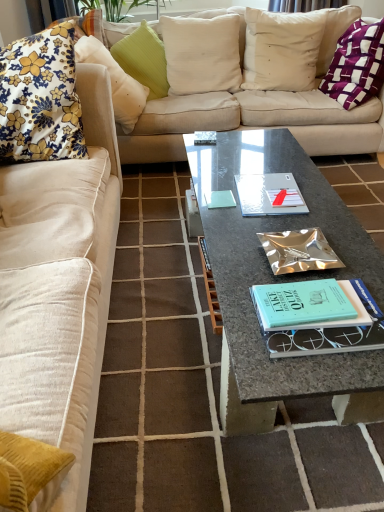
Find the location of a particular element. The image size is (384, 512). free location to the right of metallic silver book at center is located at coordinates (352, 250).